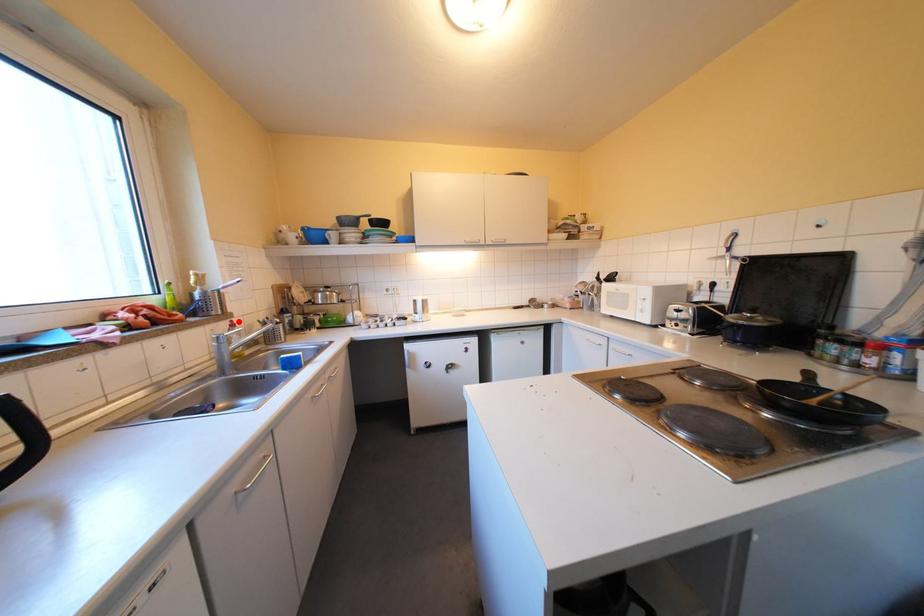
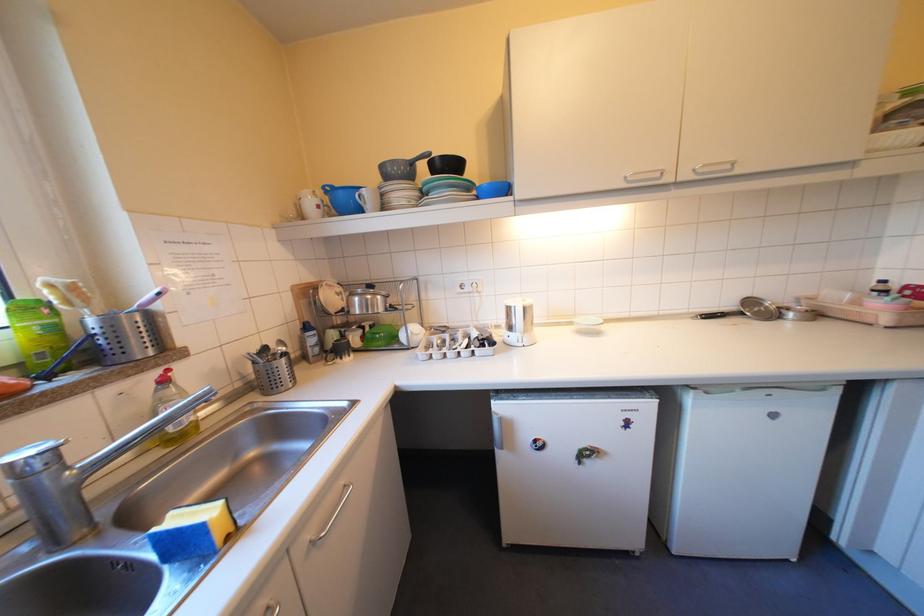
Find the pixel in the second image that matches the highlighted location in the first image.

(168, 371)